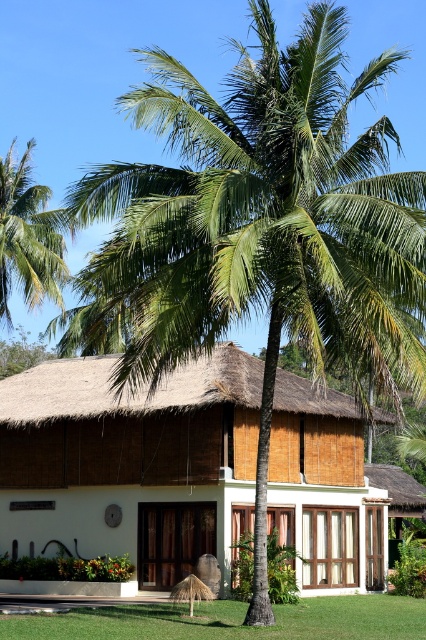
Between green grass at lower center and green leafy palm tree at upper left, which one is positioned lower?

Positioned lower is green grass at lower center.

Does green grass at lower center have a lesser height compared to green leafy palm tree at upper left?

Correct, green grass at lower center is not as tall as green leafy palm tree at upper left.

Measure the distance between green grass at lower center and camera.

green grass at lower center and camera are 18.77 meters apart from each other.

At what (x,y) coordinates should I click in order to perform the action: click on green grass at lower center. Please return your answer as a coordinate pair (x, y). Looking at the image, I should click on (230, 620).

Identify the location of white wood cottage at center. (132, 461).

Between white wood cottage at center and green leafy palm tree at upper left, which one is positioned lower?

Positioned lower is white wood cottage at center.

This screenshot has height=640, width=426. In order to click on white wood cottage at center in this screenshot , I will do `click(132, 461)`.

In order to click on white wood cottage at center in this screenshot , I will do `click(132, 461)`.

Does white wood cottage at center appear under green grass at lower center?

No.

Who is taller, white wood cottage at center or green grass at lower center?

white wood cottage at center

Identify the location of white wood cottage at center. (132, 461).